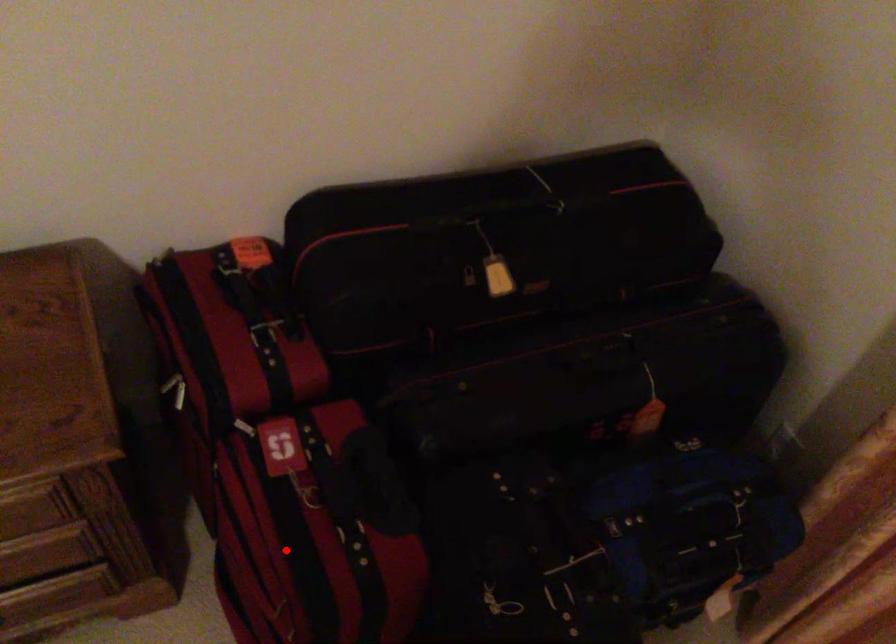
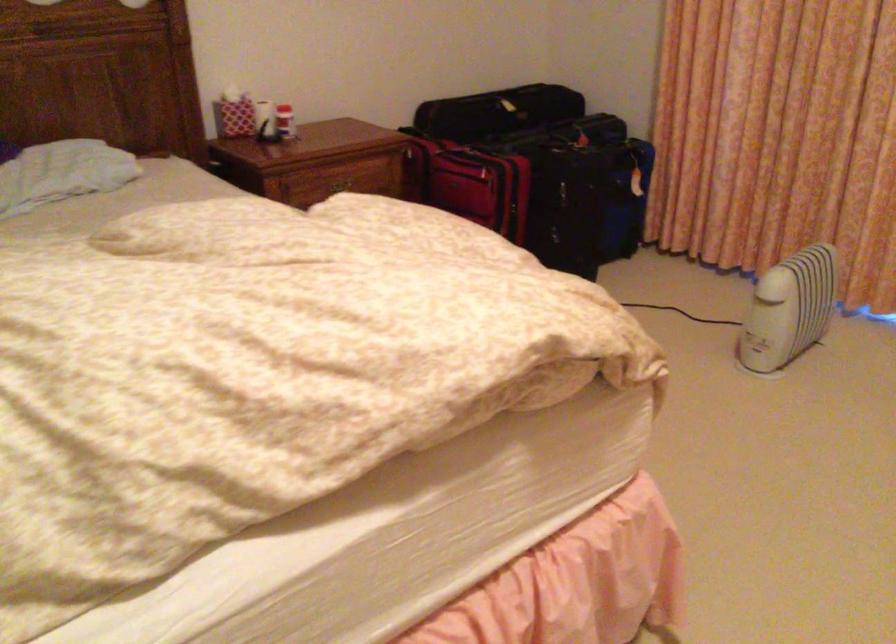
The point at the highlighted location is marked in the first image. Where is the corresponding point in the second image?

(469, 183)